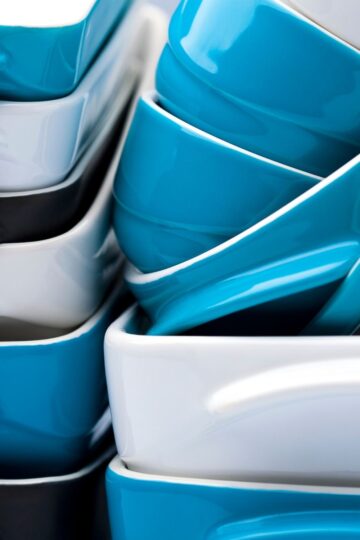
This screenshot has width=360, height=540. In order to click on bowls in left hand column in this screenshot , I will do `click(32, 511)`, `click(29, 430)`, `click(29, 298)`, `click(27, 214)`, `click(29, 152)`, `click(27, 64)`.